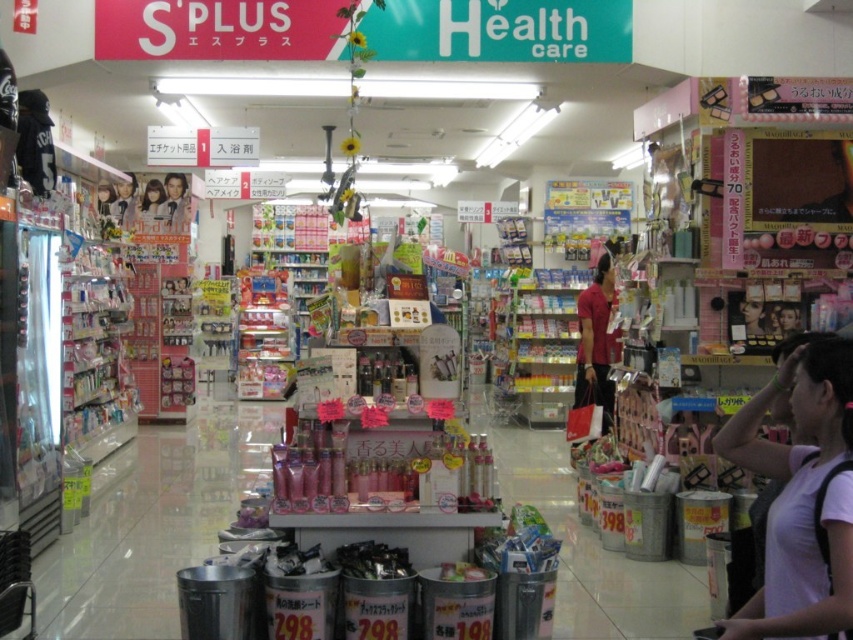
Question: Is white matte shirt at lower right thinner than smooth skin portrait at upper left?

Choices:
 (A) no
 (B) yes

Answer: (A)

Question: Which object is positioned farthest from the smooth skin doll at upper left?

Choices:
 (A) white matte shirt at lower right
 (B) smooth skin portrait at upper left
 (C) matte black hair at left
 (D) red matte t-shirt at center

Answer: (A)

Question: Which point appears closest to the camera in this image?

Choices:
 (A) (804, 369)
 (B) (115, 200)
 (C) (167, 184)

Answer: (A)

Question: Does white matte shirt at lower right have a greater width compared to smooth skin portrait at upper left?

Choices:
 (A) no
 (B) yes

Answer: (B)

Question: Among these objects, which one is farthest from the camera?

Choices:
 (A) red matte t-shirt at center
 (B) white matte shirt at lower right
 (C) smooth skin portrait at upper left
 (D) matte black hair at left

Answer: (C)

Question: Can you confirm if white matte shirt at lower right is smaller than matte black hair at left?

Choices:
 (A) yes
 (B) no

Answer: (B)